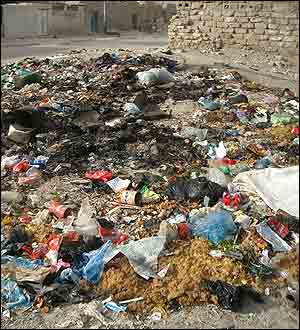
Where is `window`? This screenshot has width=300, height=330. window is located at coordinates (70, 9).